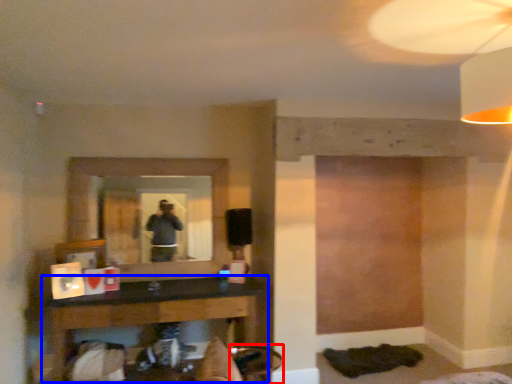
Question: Which object is further to the camera taking this photo, swivel chair (highlighted by a red box) or table (highlighted by a blue box)?

Choices:
 (A) swivel chair
 (B) table

Answer: (B)